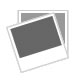
Identify the location of background picture. (41, 12).